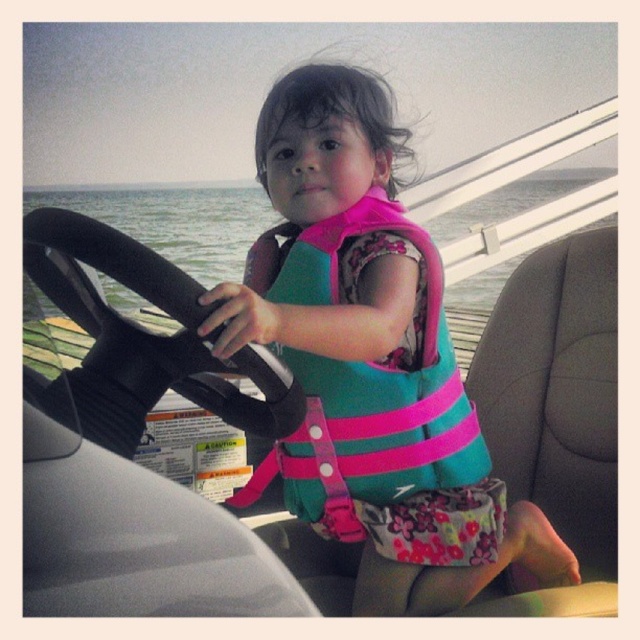
You are navigating a boat and need to adjust the position of two points on the dashboard controls. The points are labeled as point (340, 289) and point (365, 435). From your perspective sitting in the boat, which point is closer to the front of the boat?

Point (365, 435) is closer to the front of the boat because it is in front of point (340, 289).